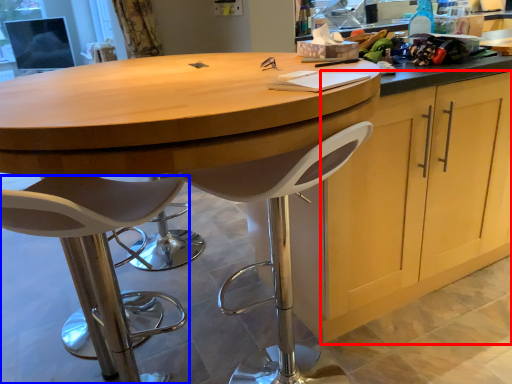
Question: Which object appears farthest to the camera in this image, cabinetry (highlighted by a red box) or chair (highlighted by a blue box)?

Choices:
 (A) cabinetry
 (B) chair

Answer: (A)